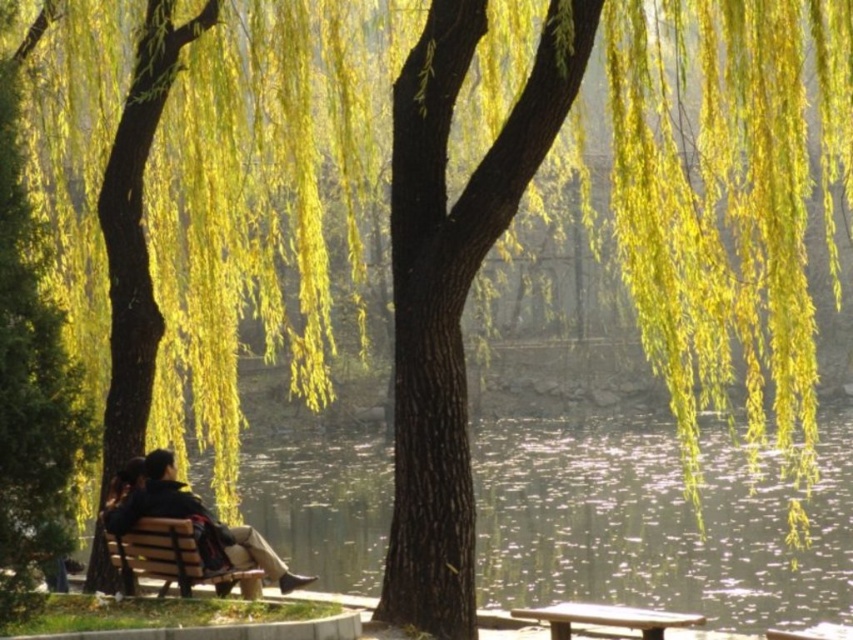
Question: Observing the image, what is the correct spatial positioning of wooden bench at center in reference to wooden park bench at center?

Choices:
 (A) left
 (B) right

Answer: (A)

Question: Can you confirm if dark brown leather bench at lower left is positioned above wooden park bench at center?

Choices:
 (A) no
 (B) yes

Answer: (B)

Question: Which point is closer to the camera?

Choices:
 (A) (177, 570)
 (B) (291, 589)

Answer: (A)

Question: Which point is farther to the camera?

Choices:
 (A) (170, 458)
 (B) (224, 573)

Answer: (A)

Question: Which object appears farthest from the camera in this image?

Choices:
 (A) wooden bench at center
 (B) dark brown leather bench at lower left
 (C) wooden park bench at center

Answer: (B)

Question: Does dark brown leather bench at lower left have a greater width compared to wooden bench at center?

Choices:
 (A) yes
 (B) no

Answer: (A)